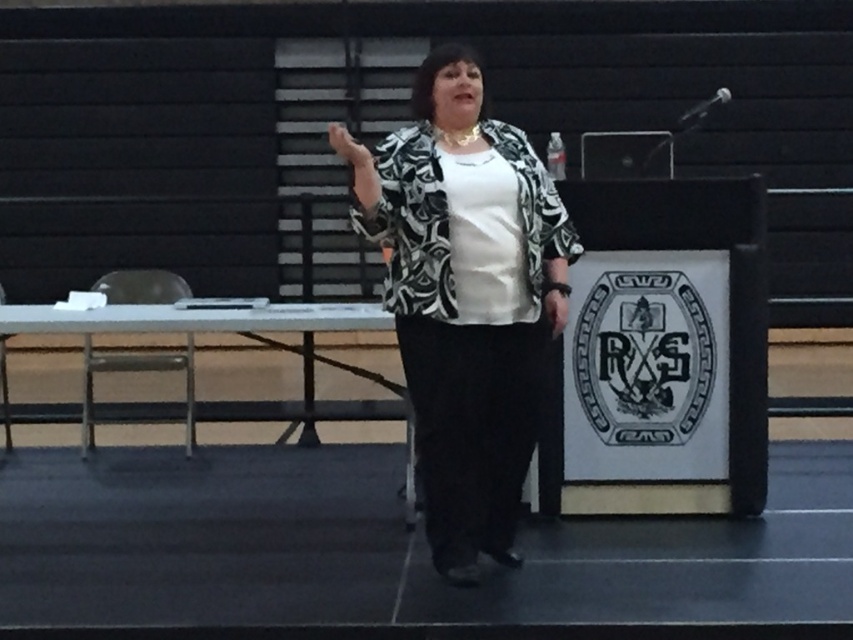
Between point (404, 275) and point (363, 147), which one is positioned behind?

Point (404, 275)

Can you confirm if printed fabric jacket at center is positioned to the right of matte black hand at upper center?

Yes, printed fabric jacket at center is to the right of matte black hand at upper center.

The image size is (853, 640). Identify the location of printed fabric jacket at center. (467, 300).